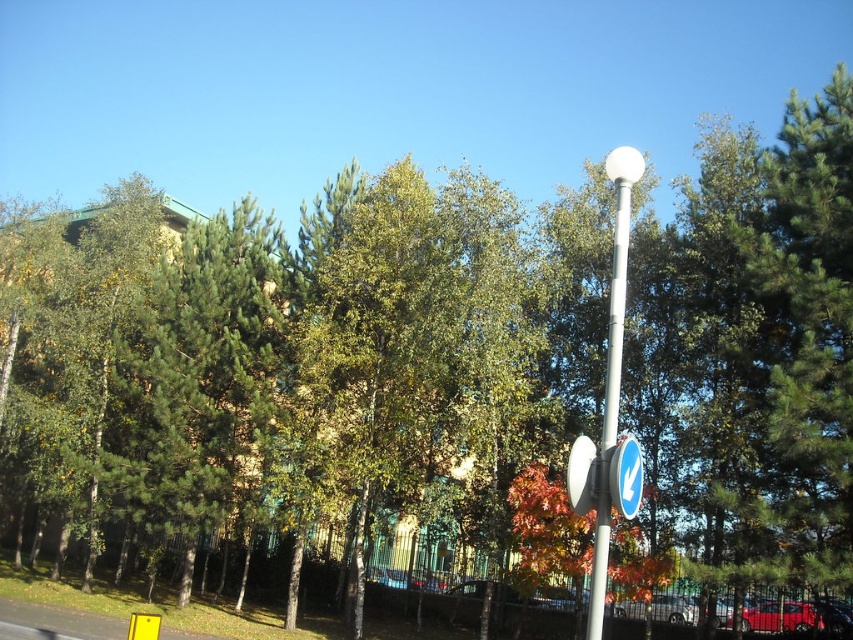
You are standing at the point with coordinates (611, 369) in the image. What object are you most likely standing on or near?

The point (611, 369) corresponds to the white glossy lamp post at upper right, so you are most likely standing near the white glossy lamp post at upper right.

You are standing at the center of the scene looking towards the upper right corner. There is a white glossy lamp post at upper right. Can you estimate its location in terms of coordinates?

The white glossy lamp post at upper right is located at coordinates point (x=611, y=369).